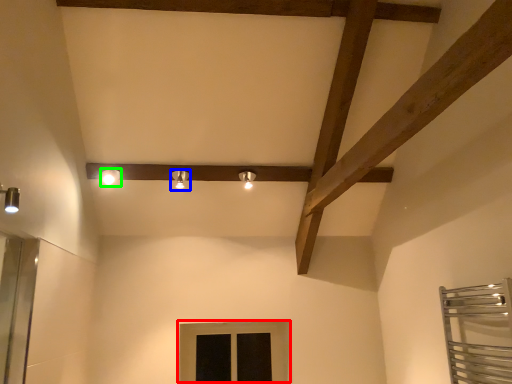
Question: Estimate the real-world distances between objects in this image. Which object is closer to window (highlighted by a red box), light fixture (highlighted by a blue box) or light fixture (highlighted by a green box)?

Choices:
 (A) light fixture
 (B) light fixture

Answer: (A)